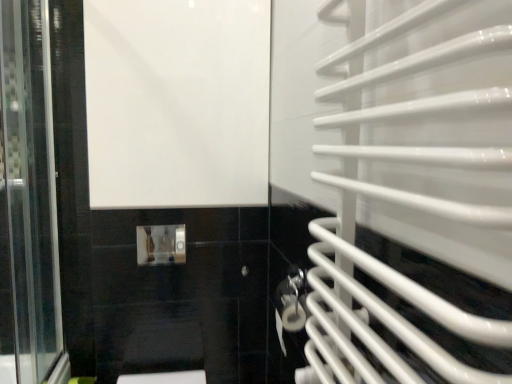
The height and width of the screenshot is (384, 512). Describe the element at coordinates (414, 176) in the screenshot. I see `white glossy towel rack at right` at that location.

Locate an element on the screen. The height and width of the screenshot is (384, 512). white glossy towel rack at right is located at coordinates (414, 176).

At what (x,y) coordinates should I click in order to perform the action: click on white glossy towel rack at right. Please return your answer as a coordinate pair (x, y). This screenshot has height=384, width=512. Looking at the image, I should click on (414, 176).